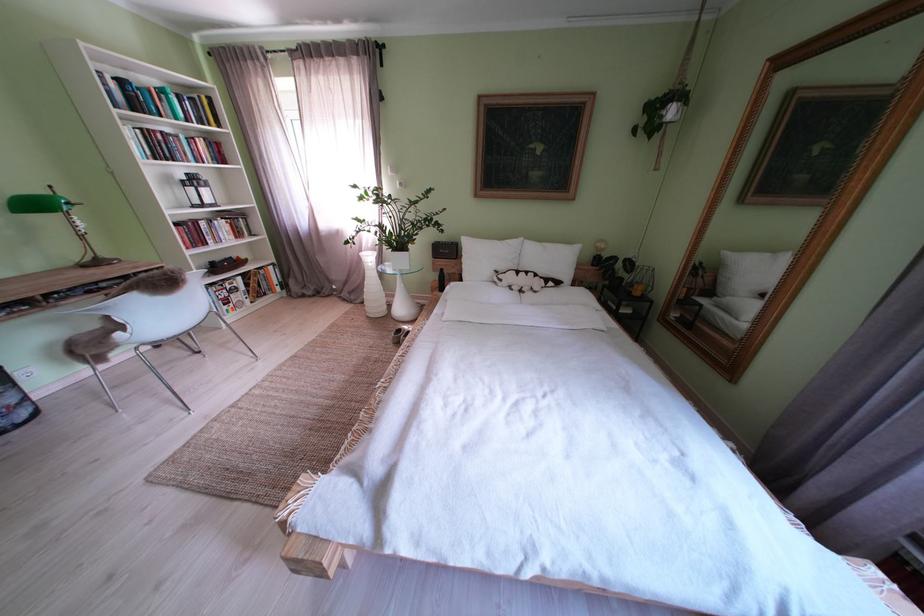
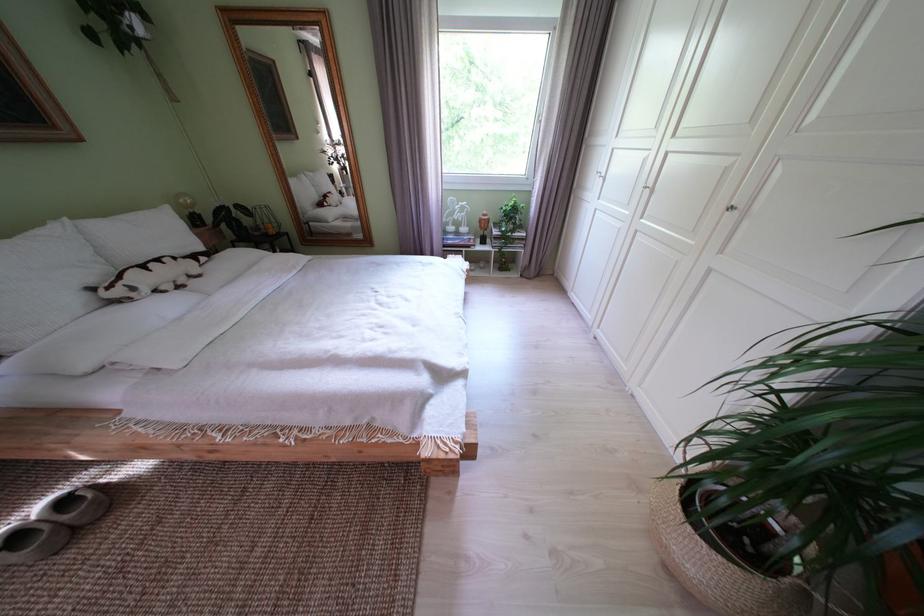
Locate, in the second image, the point that corresponds to [410,336] in the first image.

(28, 543)